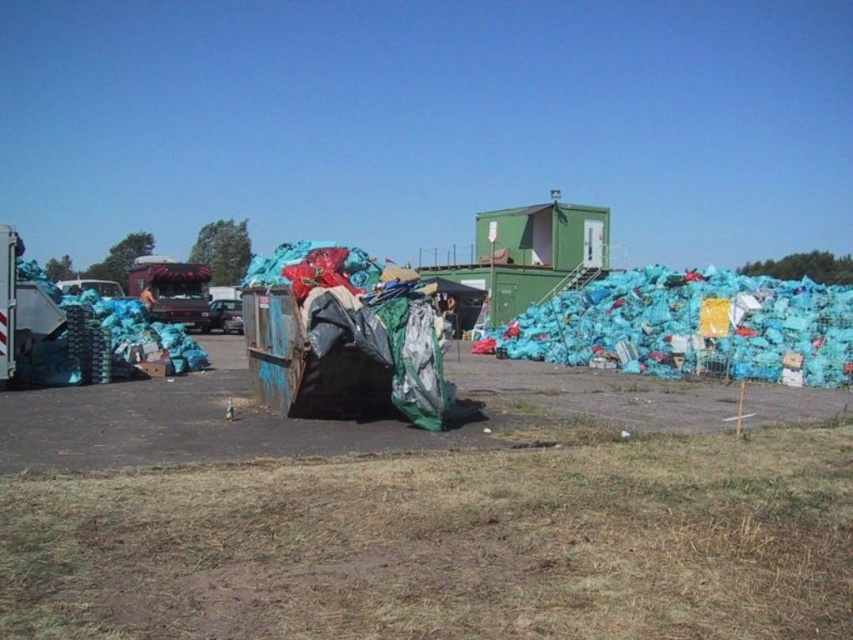
Between point (498, 346) and point (277, 317), which one is positioned in front?

Point (277, 317)

Between blue plastic bags at right and rusty metal dumpster at center, which one has less height?

Standing shorter between the two is rusty metal dumpster at center.

Which is behind, point (564, 358) or point (343, 337)?

The point (564, 358) is more distant.

I want to click on blue plastic bags at right, so (692, 326).

What do you see at coordinates (326, 337) in the screenshot? I see `rusty metal dumpster at center` at bounding box center [326, 337].

Does point (352, 250) come farther from viewer compared to point (97, 304)?

No, (352, 250) is closer to viewer.

You are a GUI agent. You are given a task and a screenshot of the screen. Output one action in this format:
    pyautogui.click(x=<x>, y=<y>)
    Task: Click on the rusty metal dumpster at center
    
    Given the screenshot: What is the action you would take?
    pyautogui.click(x=326, y=337)

Is blue plastic bags at right taller than blue plastic bags at left?

Correct, blue plastic bags at right is much taller as blue plastic bags at left.

The image size is (853, 640). What do you see at coordinates (692, 326) in the screenshot?
I see `blue plastic bags at right` at bounding box center [692, 326].

This screenshot has height=640, width=853. Describe the element at coordinates (692, 326) in the screenshot. I see `blue plastic bags at right` at that location.

Find the location of `blue plastic bags at right`. blue plastic bags at right is located at coordinates tap(692, 326).